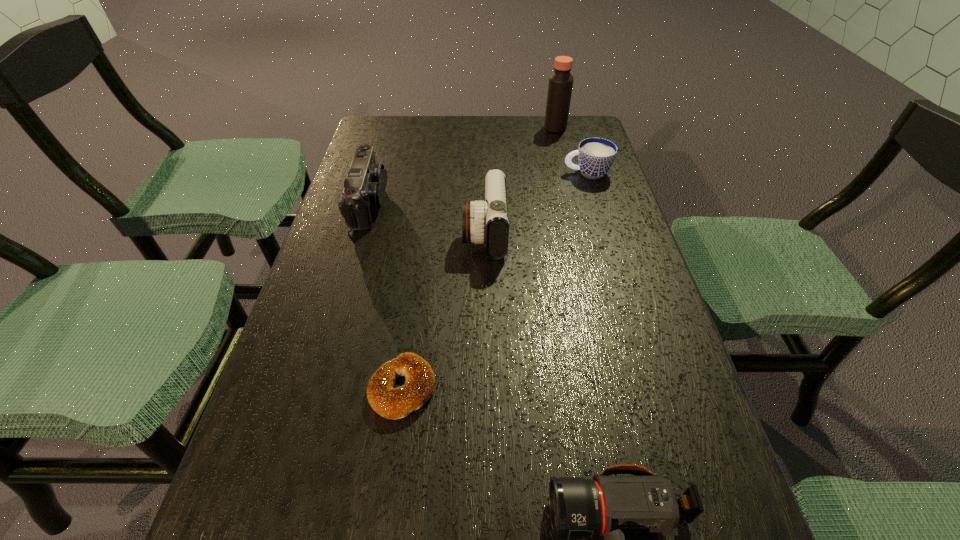
This screenshot has height=540, width=960. Find the location of `free space between the tallest object and the leftmost object`. free space between the tallest object and the leftmost object is located at coordinates (462, 166).

This screenshot has width=960, height=540. Find the location of `unoccupied position between the fourth object from right to left and the leftmost camcorder`. unoccupied position between the fourth object from right to left and the leftmost camcorder is located at coordinates (427, 218).

Find the location of a particular element. This screenshot has width=960, height=540. unoccupied position between the tallest object and the fifth object from right to left is located at coordinates (479, 258).

Identify the location of object that ranks as the third closest to the nearest camcorder. Image resolution: width=960 pixels, height=540 pixels. (364, 187).

Point out which object is positioned as the third nearest to the shortest camcorder. Please provide its 2D coordinates. Your answer should be formatted as a tuple, i.e. [(x, y)], where the tuple contains the x and y coordinates of a point satisfying the conditions above.

[(364, 187)]

Locate an element on the screen. Image resolution: width=960 pixels, height=540 pixels. camcorder that is the closest to the second camcorder from right to left is located at coordinates (364, 187).

At what (x,y) coordinates should I click in order to perform the action: click on camcorder that can be found as the closest to the leftmost object. Please return your answer as a coordinate pair (x, y). Looking at the image, I should click on (487, 221).